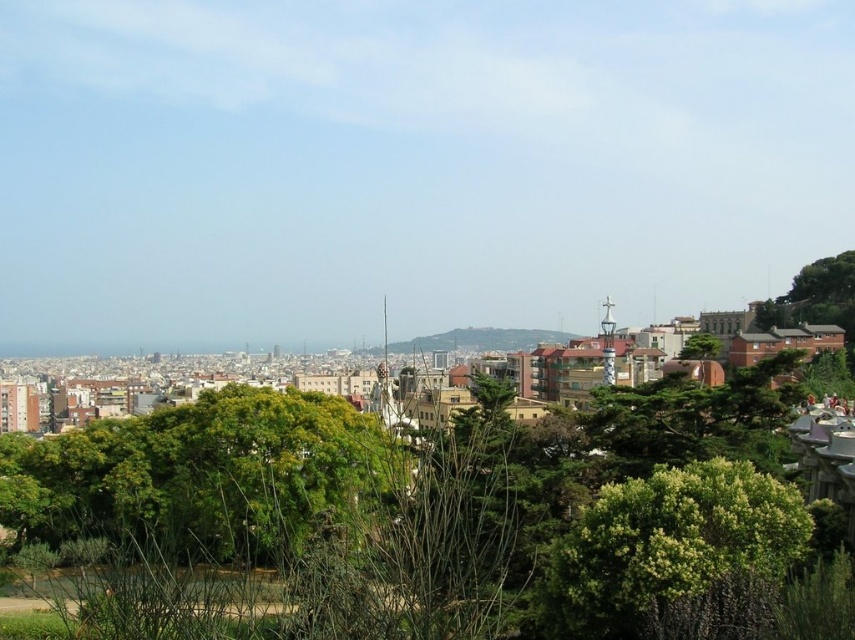
Question: Considering the real-world distances, which object is closest to the green leafy tree at upper right?

Choices:
 (A) green leafy bush at center-right
 (B) green leafy tree at center
 (C) green grassy hillside at center

Answer: (A)

Question: Considering the real-world distances, which object is farthest from the green grassy hillside at center?

Choices:
 (A) green leafy tree at center
 (B) green leafy bush at center-right

Answer: (B)

Question: Which object is closer to the camera taking this photo?

Choices:
 (A) green leafy bush at center-right
 (B) green leafy tree at upper right
 (C) green grassy hillside at center

Answer: (A)

Question: Is green leafy bush at center-right below green leafy tree at upper right?

Choices:
 (A) yes
 (B) no

Answer: (A)

Question: Is green leafy tree at center wider than green leafy bush at center-right?

Choices:
 (A) yes
 (B) no

Answer: (A)

Question: Does green leafy bush at center-right have a lesser width compared to green leafy tree at upper right?

Choices:
 (A) no
 (B) yes

Answer: (B)